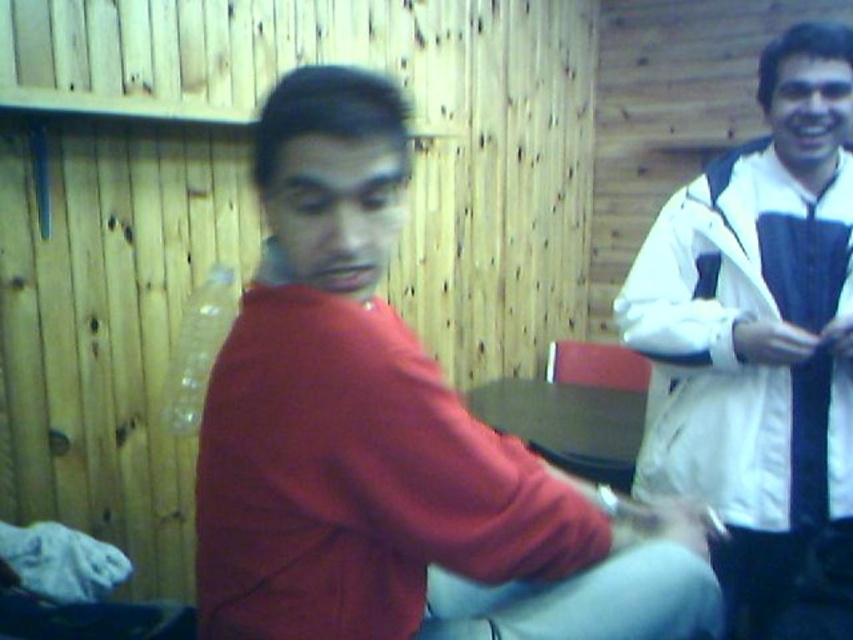
Question: Among these objects, which one is nearest to the camera?

Choices:
 (A) matte red shirt at center
 (B) white matte jacket at upper right
 (C) black silk tie at right

Answer: (A)

Question: Can you confirm if matte red shirt at center is positioned above black silk tie at right?

Choices:
 (A) no
 (B) yes

Answer: (A)

Question: Is white matte jacket at upper right smaller than black silk tie at right?

Choices:
 (A) yes
 (B) no

Answer: (B)

Question: Based on their relative distances, which object is farther from the white matte jacket at upper right?

Choices:
 (A) matte red shirt at center
 (B) black silk tie at right

Answer: (A)

Question: Does matte red shirt at center have a greater width compared to black silk tie at right?

Choices:
 (A) no
 (B) yes

Answer: (B)

Question: Which object is positioned farthest from the black silk tie at right?

Choices:
 (A) matte red shirt at center
 (B) white matte jacket at upper right

Answer: (A)